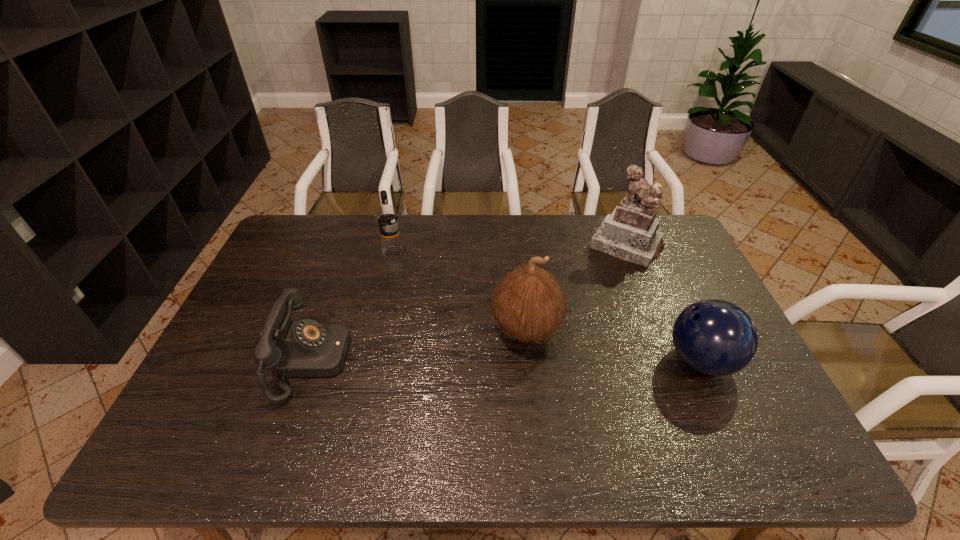
The height and width of the screenshot is (540, 960). I want to click on free space on the desktop that is between the telephone and the bowling ball and is positioned on the surface of the coconut, so click(459, 361).

Locate an element on the screen. This screenshot has height=540, width=960. free spot on the desktop that is between the shortest object and the bowling ball and is positioned on the label of the third shortest object is located at coordinates (493, 361).

Identify the location of free space on the desktop that is between the telephone and the bowling ball and is positioned on the front-facing side of the figurine. (549, 361).